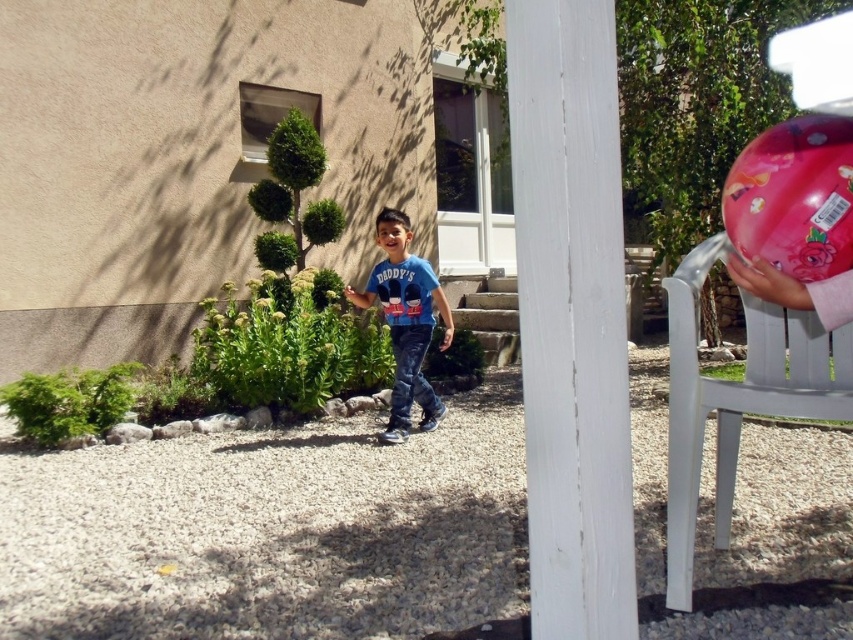
You are a photographer setting up a tripod in this scene. You need to place the tripod between the white plastic chair at right and the blue denim jeans at center. Which object should you position the tripod closer to if you want the tripod to be as far as possible from the narrower object?

The white plastic chair at right might be wider than blue denim jeans at center. To position the tripod as far as possible from the narrower object, which is the blue denim jeans at center, you should place the tripod closer to the white plastic chair at right.